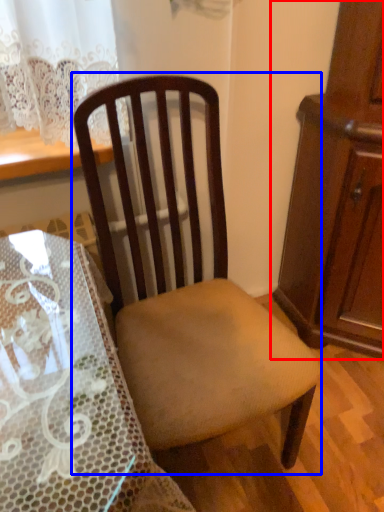
Question: Which of the following is the farthest to the observer, cabinetry (highlighted by a red box) or chair (highlighted by a blue box)?

Choices:
 (A) cabinetry
 (B) chair

Answer: (A)